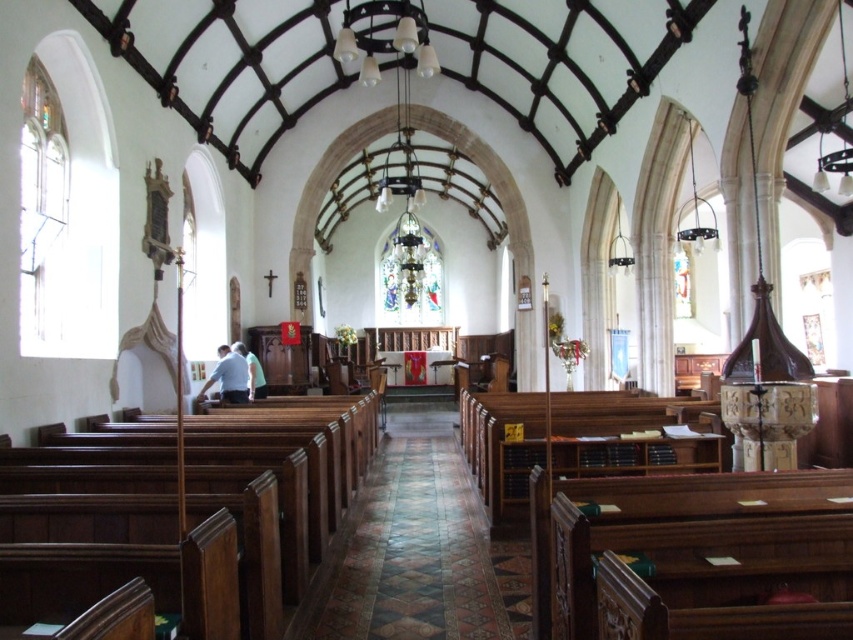
Is white shirt at center below light blue fabric at center?

Yes, white shirt at center is below light blue fabric at center.

Image resolution: width=853 pixels, height=640 pixels. In order to click on white shirt at center in this screenshot , I will do `click(228, 376)`.

Which is behind, point (306, 628) or point (238, 353)?

The point (238, 353) is behind.

Does point (514, 608) lie in front of point (227, 348)?

Yes, point (514, 608) is closer to viewer.

This screenshot has height=640, width=853. I want to click on carpeted wooden aisle at center, so click(x=416, y=548).

Can you confirm if carpeted wooden aisle at center is shorter than light blue fabric at center?

Correct, carpeted wooden aisle at center is not as tall as light blue fabric at center.

Does carpeted wooden aisle at center have a greater height compared to light blue fabric at center?

No.

Where is `carpeted wooden aisle at center`? carpeted wooden aisle at center is located at coordinates (416, 548).